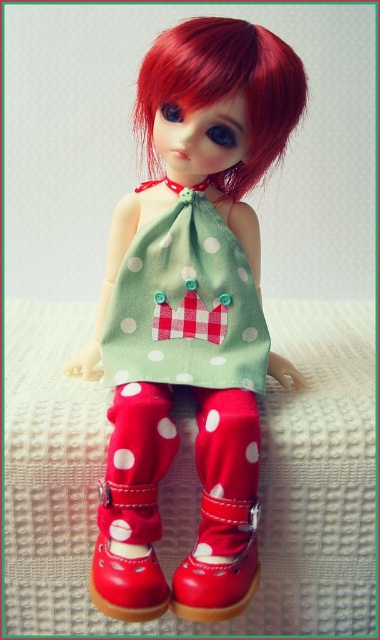
Is point (60, 529) less distant than point (142, 525)?

That is False.

Can you confirm if white textured bed at center is positioned above white polka dot fabric socks at lower center?

Correct, white textured bed at center is located above white polka dot fabric socks at lower center.

Find the location of a particular element. The height and width of the screenshot is (640, 380). white textured bed at center is located at coordinates (259, 484).

Who is higher up, matte green fabric dress at center or white textured bed at center?

matte green fabric dress at center is higher up.

Does matte green fabric dress at center appear over white textured bed at center?

Indeed, matte green fabric dress at center is positioned over white textured bed at center.

Which is behind, point (166, 204) or point (296, 600)?

Positioned behind is point (296, 600).

Where is `matte green fabric dress at center`? This screenshot has height=640, width=380. matte green fabric dress at center is located at coordinates (191, 316).

Who is positioned more to the left, matte green fabric dress at center or red silky hair at center?

From the viewer's perspective, matte green fabric dress at center appears more on the left side.

Locate an element on the screen. Image resolution: width=380 pixels, height=640 pixels. matte green fabric dress at center is located at coordinates (191, 316).